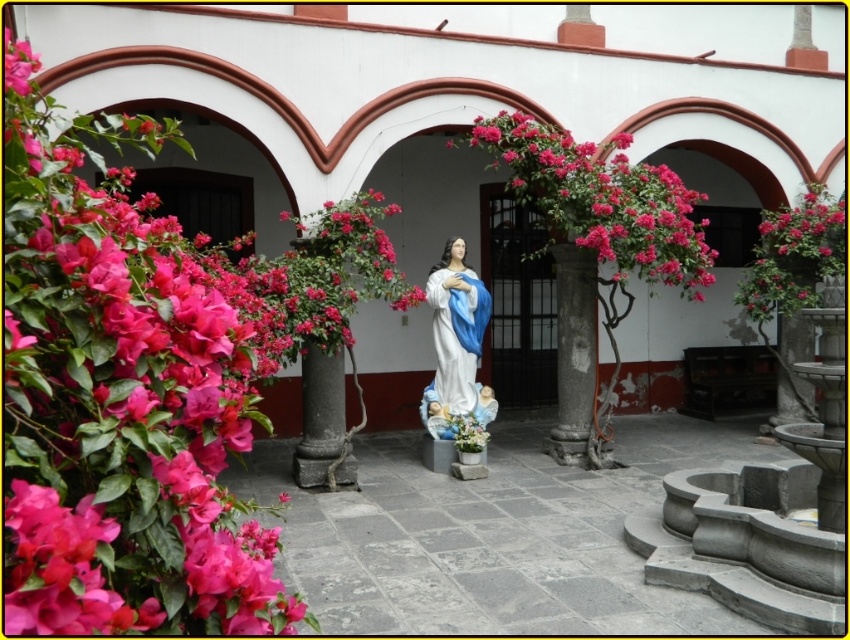
Question: Can you confirm if matte pink flowers at left is positioned above white glossy statue at center?

Choices:
 (A) yes
 (B) no

Answer: (A)

Question: Among these points, which one is farthest from the camera?

Choices:
 (A) (576, 273)
 (B) (769, 230)
 (C) (690, 253)
 (D) (142, 268)

Answer: (B)

Question: Can you confirm if matte pink flowers at left is positioned above pink glossy flowers at center?

Choices:
 (A) no
 (B) yes

Answer: (A)

Question: Does pink glossy flowers at center have a greater width compared to gray stone column at center?

Choices:
 (A) no
 (B) yes

Answer: (B)

Question: Which object appears closest to the camera in this image?

Choices:
 (A) matte pink flowers at left
 (B) gray stone column at center

Answer: (A)

Question: Which point appears farthest from the camera in this image?

Choices:
 (A) (187, 324)
 (B) (761, 236)
 (C) (582, 323)
 (D) (812, 291)

Answer: (B)